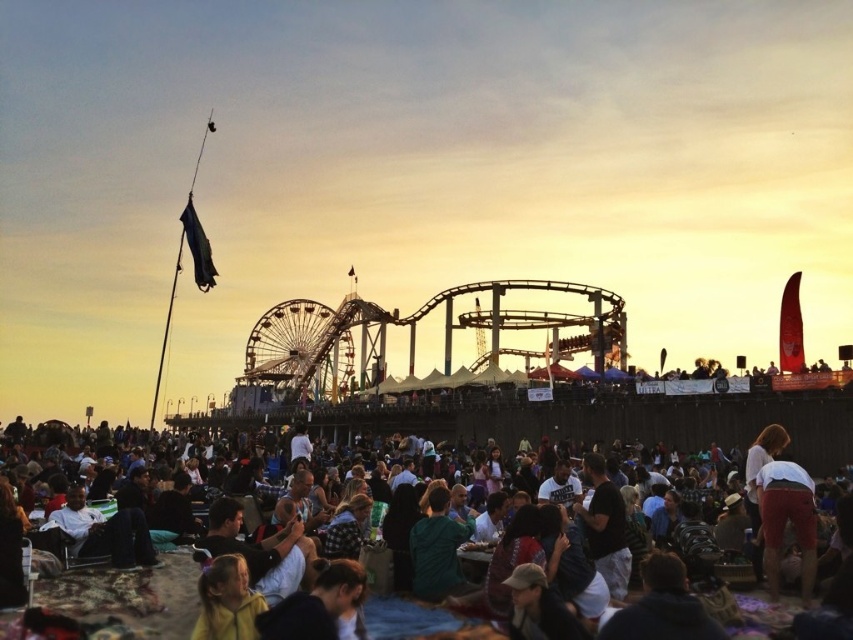
Consider the image. Does dark clothing crowd at lower center appear under metallic roller coaster at center?

Correct, dark clothing crowd at lower center is located below metallic roller coaster at center.

Is point (184, 474) positioned before point (279, 310)?

Yes, point (184, 474) is closer to viewer.

Does point (131, 584) lie behind point (321, 339)?

No.

The height and width of the screenshot is (640, 853). Identify the location of dark clothing crowd at lower center. (434, 557).

Who is more distant from viewer, (497,284) or (277,317)?

Positioned behind is point (277,317).

The height and width of the screenshot is (640, 853). I want to click on metallic roller coaster at center, so click(415, 333).

Is dark clothing crowd at lower center to the left of metallic ferris wheel at center from the viewer's perspective?

Incorrect, dark clothing crowd at lower center is not on the left side of metallic ferris wheel at center.

The image size is (853, 640). What are the coordinates of `dark clothing crowd at lower center` in the screenshot? It's located at (434, 557).

The width and height of the screenshot is (853, 640). What are the coordinates of `dark clothing crowd at lower center` in the screenshot? It's located at (434, 557).